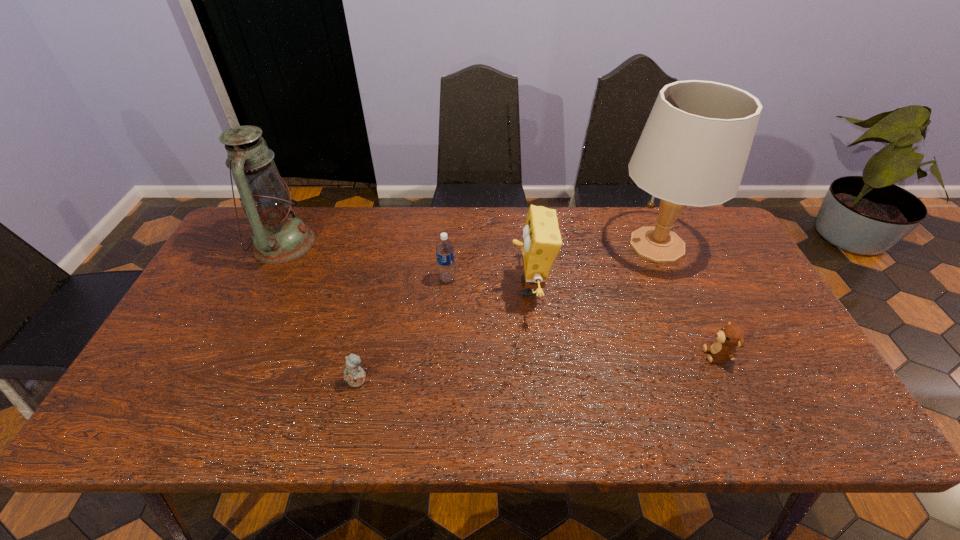
The image size is (960, 540). Find the location of `free space located 0.180m on the left of the table lamp`. free space located 0.180m on the left of the table lamp is located at coordinates (554, 245).

Where is `free location located on the back of the leftmost object`? Image resolution: width=960 pixels, height=540 pixels. free location located on the back of the leftmost object is located at coordinates (300, 210).

At what (x,y) coordinates should I click in order to perform the action: click on vacant space located 0.250m on the face of the third object from right to left. Please return your answer as a coordinate pair (x, y). Image resolution: width=960 pixels, height=540 pixels. Looking at the image, I should click on (421, 287).

Locate an element on the screen. Image resolution: width=960 pixels, height=540 pixels. vacant space located 0.070m on the face of the third object from right to left is located at coordinates (485, 287).

Where is `vacant space located on the face of the third object from right to left`? The image size is (960, 540). vacant space located on the face of the third object from right to left is located at coordinates (394, 287).

At what (x,y) coordinates should I click in order to perform the action: click on free space located on the front of the third shortest object. Please return your answer as a coordinate pair (x, y). The width and height of the screenshot is (960, 540). Looking at the image, I should click on (445, 300).

The height and width of the screenshot is (540, 960). Identify the location of vacant space situated 0.330m on the face of the second nearest object. (571, 355).

You are a GUI agent. You are given a task and a screenshot of the screen. Output one action in this format:
    pyautogui.click(x=<x>, y=<y>)
    Task: Click on the free space located 0.100m on the face of the second nearest object
    This screenshot has height=540, width=960.
    Given the screenshot: What is the action you would take?
    pyautogui.click(x=664, y=355)

Identify the location of free space located 0.050m on the face of the second nearest object. (684, 355).

At what (x,y) coordinates should I click in order to perform the action: click on vacant space situated on the front-facing side of the shorter teddy bear. Please return your answer as a coordinate pair (x, y). Looking at the image, I should click on (352, 408).